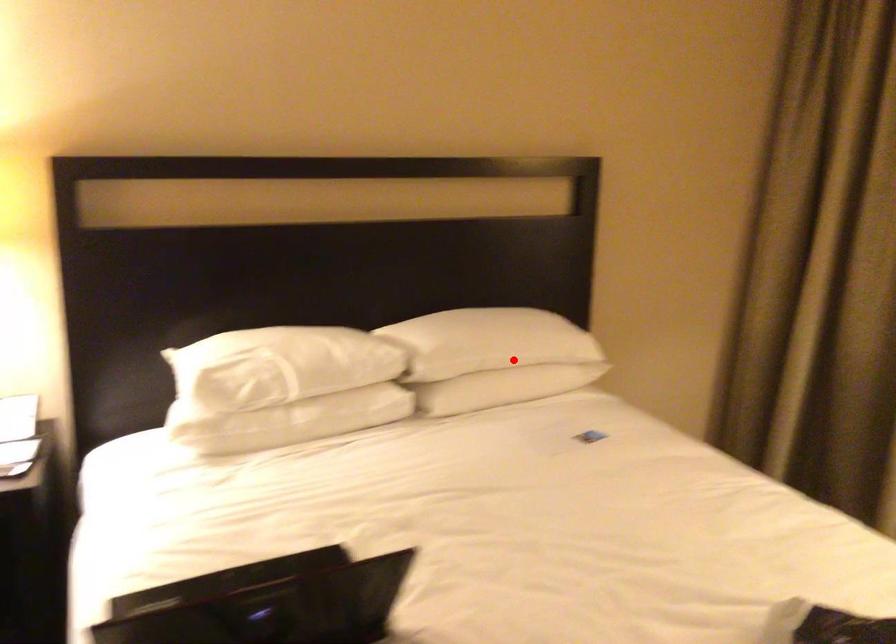
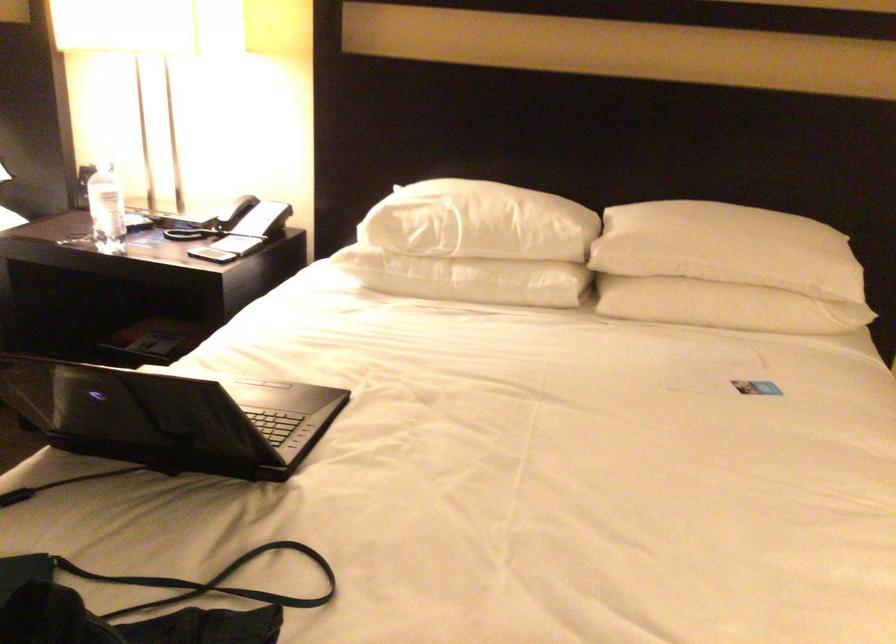
Question: A red point is marked in image1. In image2, is the corresponding 3D point closer to the camera or farther? Reply with the corresponding letter.

Choices:
 (A) The corresponding 3D point is closer.
 (B) The corresponding 3D point is farther.

Answer: (A)